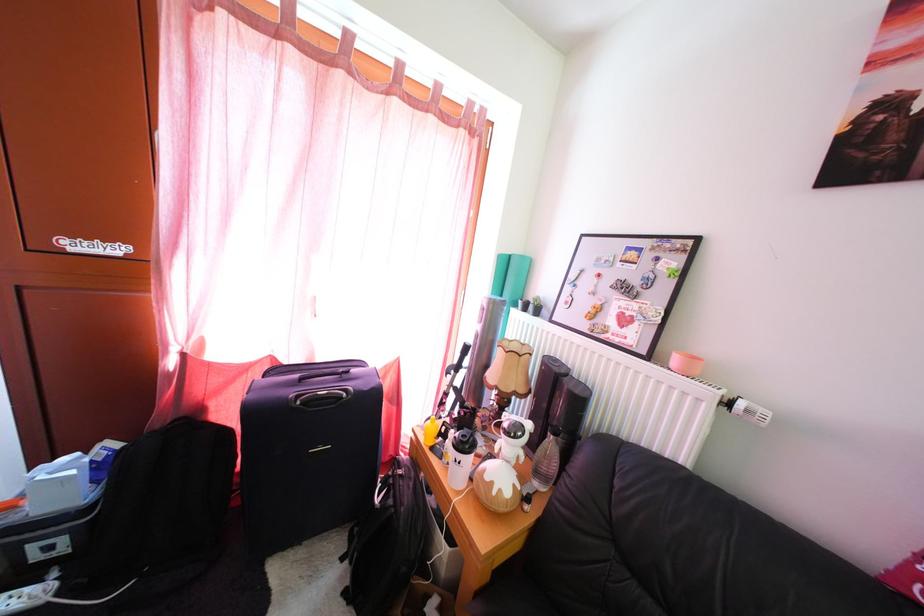
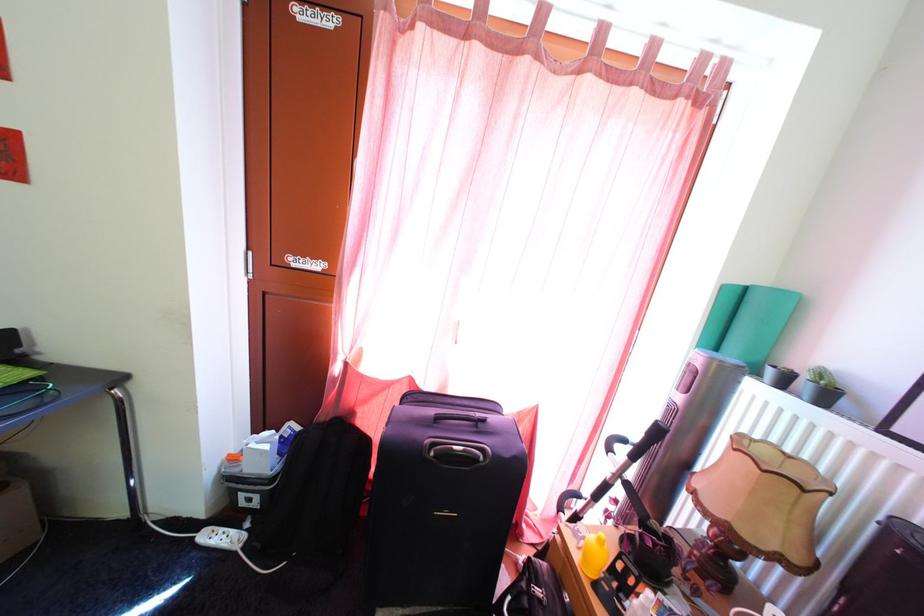
In the second image, find the point that corresponds to point 540,315 in the first image.

(813, 395)